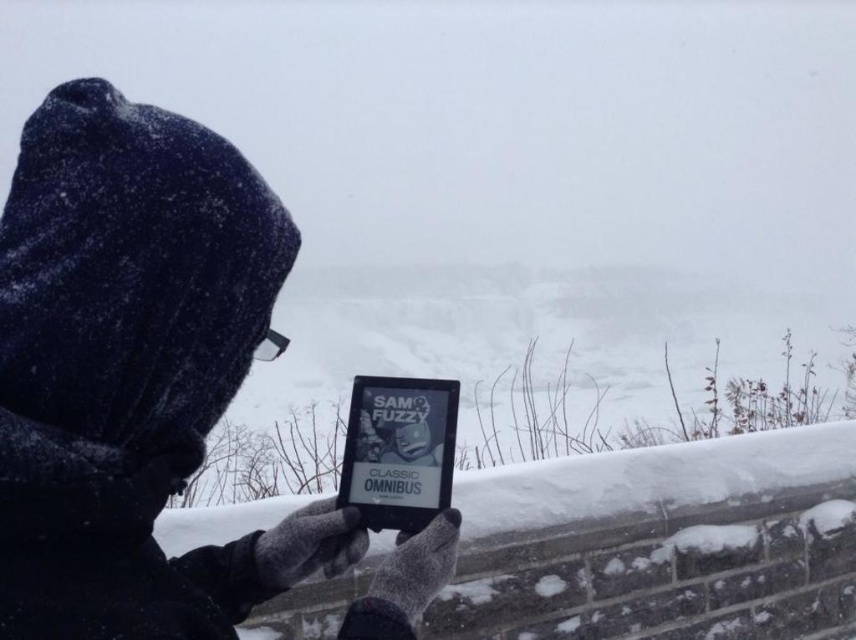
Consider the image. You are a photographer trying to capture the black fabric hood at upper left and the black matte tablet at center in the same frame. Which object should you adjust your camera angle to focus on first if you want to include both in your shot?

The black fabric hood at upper left is positioned on the left side of black matte tablet at center, so you should focus on the black fabric hood at upper left first to ensure both objects are captured in the frame.

Based on the photo, you are the person in the image holding the black matte tablet at center. You want to look up at the black fabric hood at upper left to brush off the snow. Can you do this without letting go of the tablet?

The black fabric hood at upper left is above the black matte tablet at center, so you can tilt your head upwards to look at the black fabric hood at upper left while still holding the black matte tablet at center in your hands.